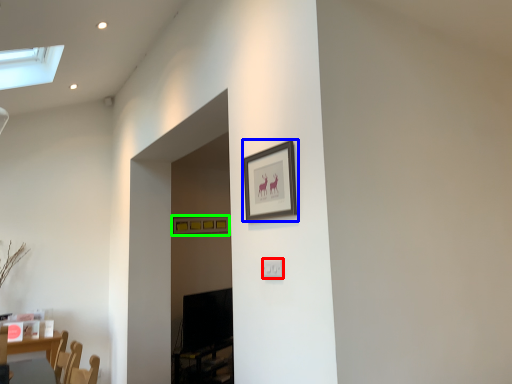
Question: Estimate the real-world distances between objects in this image. Which object is farther from electric outlet (highlighted by a red box), picture frame (highlighted by a blue box) or picture frame (highlighted by a green box)?

Choices:
 (A) picture frame
 (B) picture frame

Answer: (B)